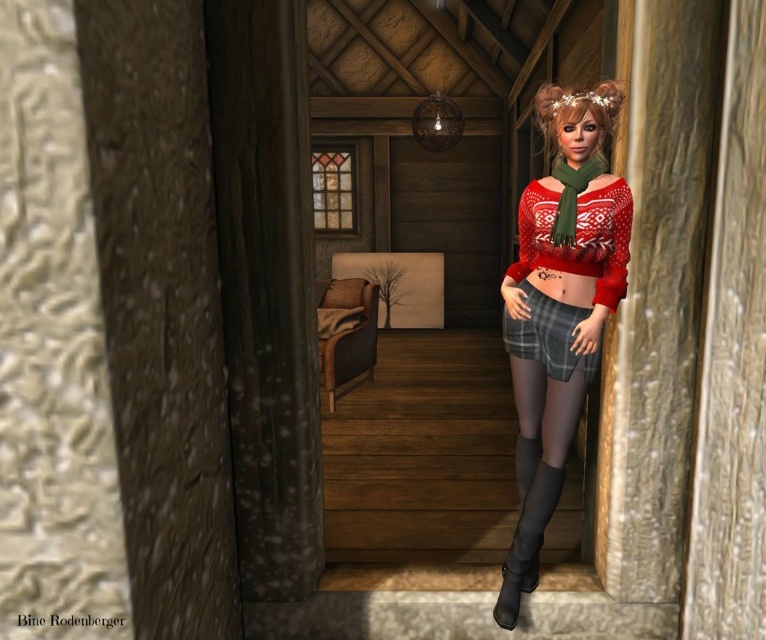
Question: Can you confirm if red matte sweater at center is bigger than blonde silky hair at upper center?

Choices:
 (A) yes
 (B) no

Answer: (A)

Question: Which of the following is the farthest from the observer?

Choices:
 (A) (588, 93)
 (B) (516, 342)
 (C) (588, 358)

Answer: (B)

Question: Is red matte sweater at center positioned behind blonde silky hair at upper center?

Choices:
 (A) yes
 (B) no

Answer: (B)

Question: Can you confirm if red matte sweater at center is positioned to the left of black leather boot at lower right?

Choices:
 (A) yes
 (B) no

Answer: (B)

Question: Which of these objects is positioned closest to the black leather boot at lower right?

Choices:
 (A) blonde silky hair at upper center
 (B) red matte sweater at center

Answer: (B)

Question: Which object is closer to the camera taking this photo?

Choices:
 (A) plaid fabric shorts at center
 (B) black leather boot at lower right
 (C) red matte sweater at center
 (D) blonde silky hair at upper center

Answer: (C)